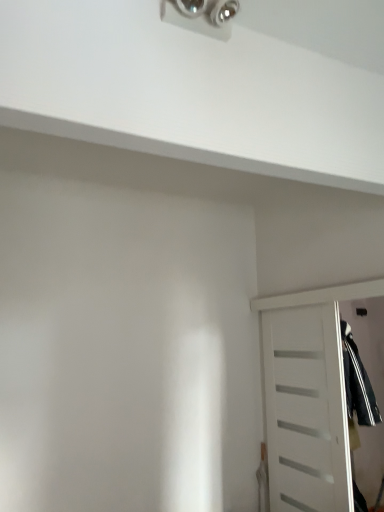
Question: In which direction should I rotate to look at metallic silver light fixture at upper center?

Choices:
 (A) right
 (B) left

Answer: (A)